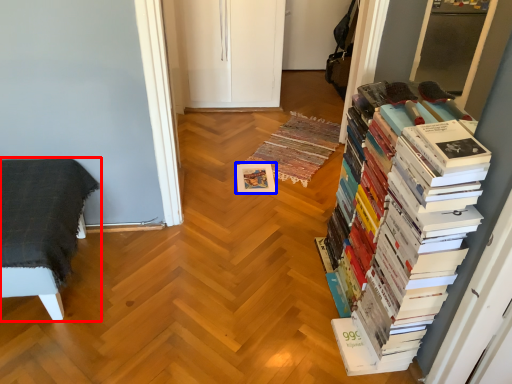
Question: Among these objects, which one is nearest to the camera, furniture (highlighted by a red box) or paperback book (highlighted by a blue box)?

Choices:
 (A) furniture
 (B) paperback book

Answer: (A)